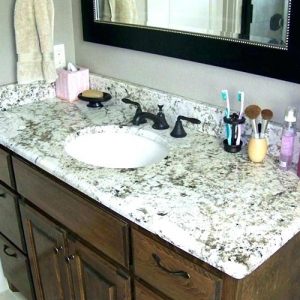
Locate an element on the screen. The width and height of the screenshot is (300, 300). soap dish is located at coordinates (96, 103).